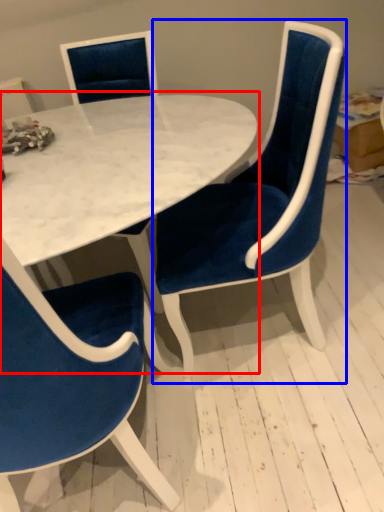
Question: Which object appears farthest to the camera in this image, table (highlighted by a red box) or chair (highlighted by a blue box)?

Choices:
 (A) table
 (B) chair

Answer: (A)